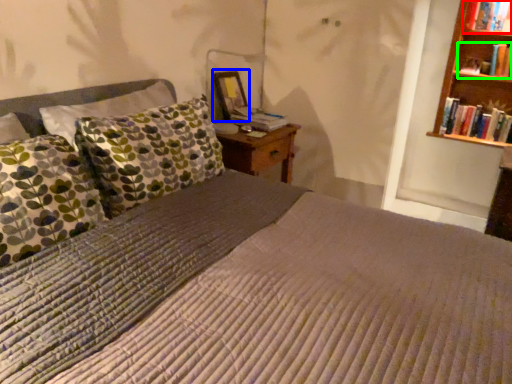
Question: Based on their relative distances, which object is farther from book (highlighted by a red box)? Choose from picture frame (highlighted by a blue box) and book (highlighted by a green box).

Choices:
 (A) picture frame
 (B) book

Answer: (A)